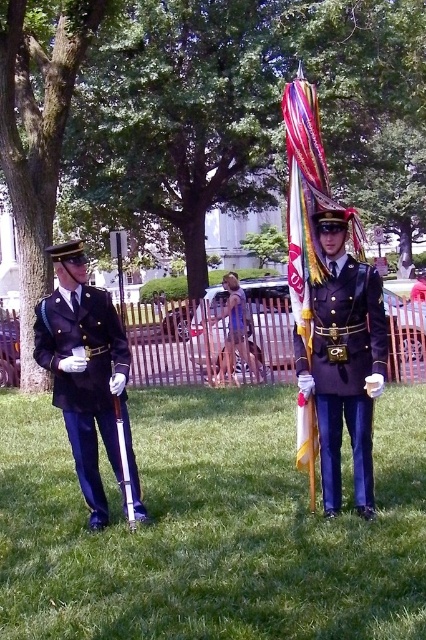
Question: Is shiny dark blue uniform at center closer to camera compared to shiny metallic flag at center?

Choices:
 (A) no
 (B) yes

Answer: (B)

Question: Which point is closer to the camera?

Choices:
 (A) (308, 109)
 (B) (49, 308)
 (C) (380, 348)

Answer: (C)

Question: Is shiny dark blue uniform at center positioned in front of navy blue fabric uniform at left?

Choices:
 (A) no
 (B) yes

Answer: (B)

Question: Considering the real-world distances, which object is farthest from the shiny dark blue uniform at center?

Choices:
 (A) navy blue fabric uniform at left
 (B) shiny metallic flag at center

Answer: (A)

Question: Which of the following is the closest to the observer?

Choices:
 (A) shiny metallic flag at center
 (B) navy blue fabric uniform at left

Answer: (A)

Question: Is the position of navy blue fabric uniform at left less distant than that of shiny metallic flag at center?

Choices:
 (A) no
 (B) yes

Answer: (A)